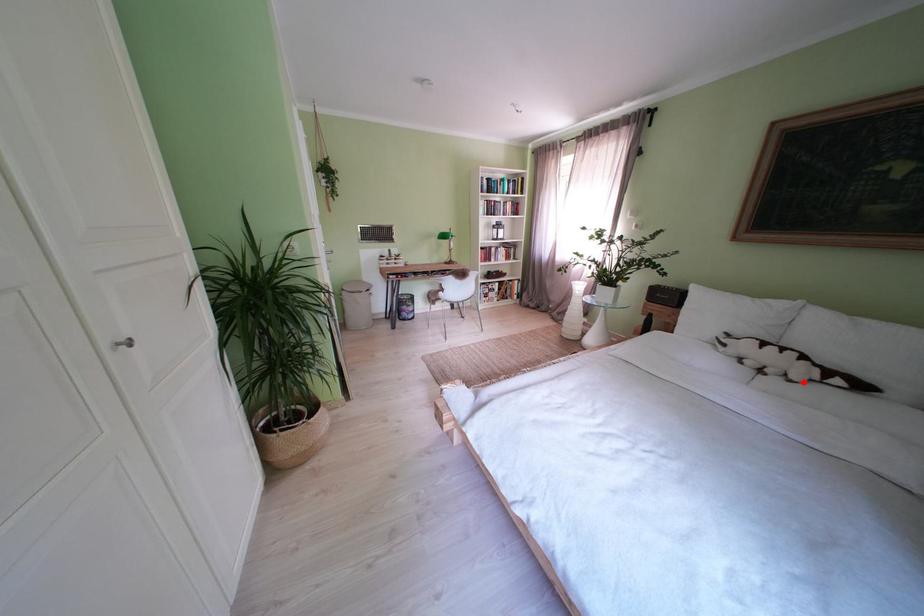
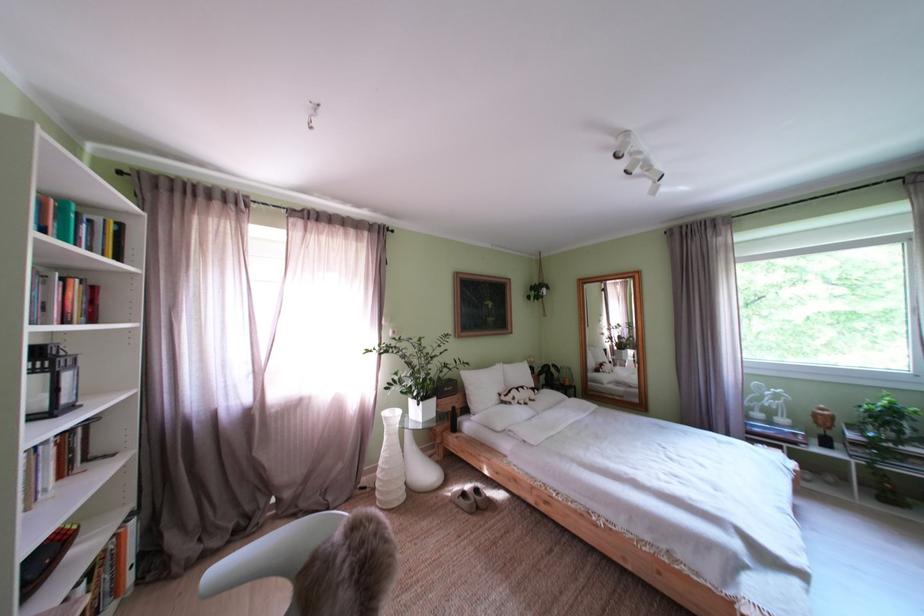
Locate, in the second image, the point that corresponds to the highlighted location in the first image.

(543, 403)